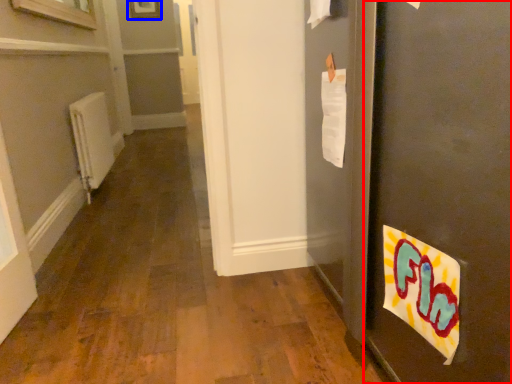
Question: Which of the following is the farthest to the observer, door (highlighted by a red box) or picture frame (highlighted by a blue box)?

Choices:
 (A) door
 (B) picture frame

Answer: (B)